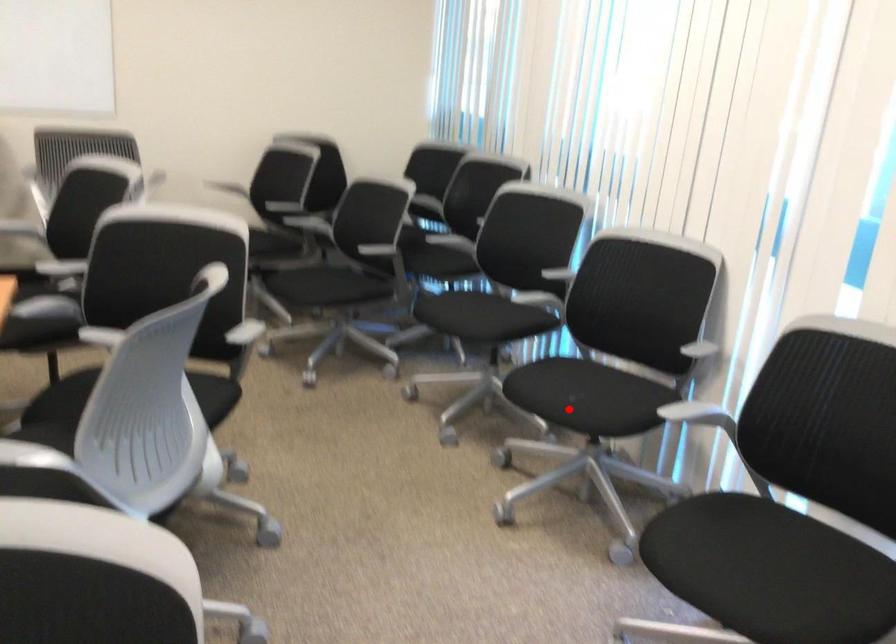
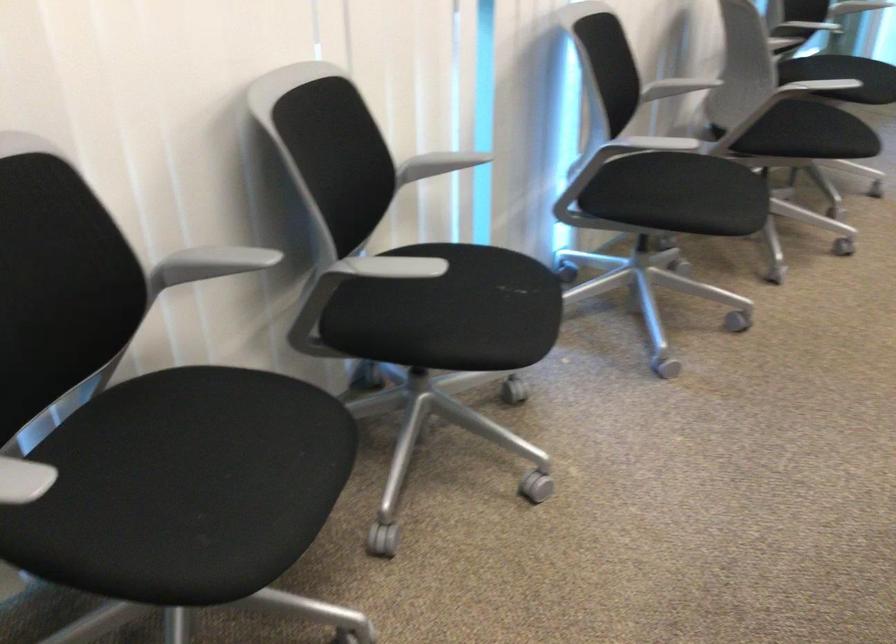
Question: A red point is marked in image1. In image2, is the corresponding 3D point closer to the camera or farther? Reply with the corresponding letter.

Choices:
 (A) The corresponding 3D point is closer.
 (B) The corresponding 3D point is farther.

Answer: (A)